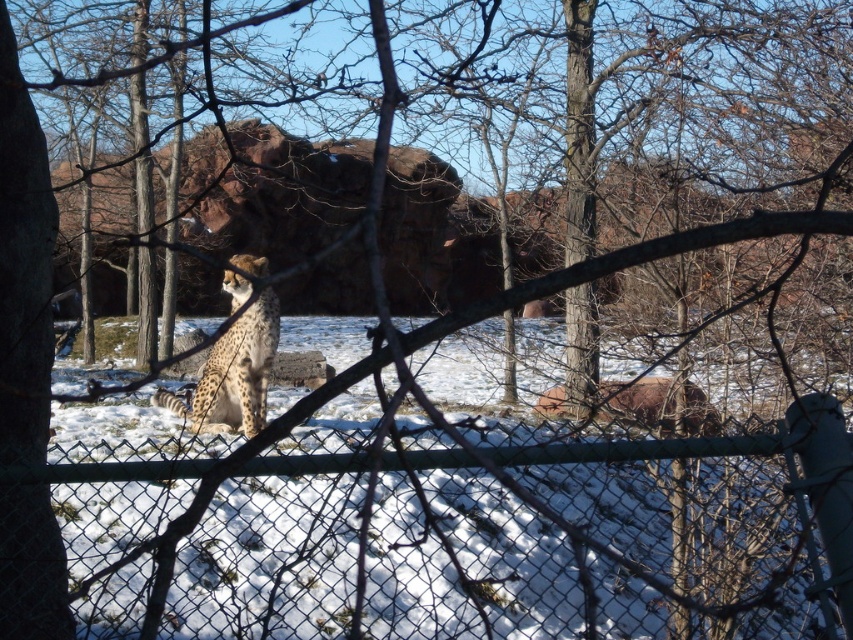
You are standing in front of the winter scene image. You see a point marked at coordinates (465,538). According to the image, what object is this point located on?

The point at coordinates (465,538) is located on the green chain link fence at center.

You are standing in front of the winter scene behind the chain link fence. You see two points marked on the image, point 1 at coordinates (521, 600) and point 2 at coordinates (263, 420). Which point is closer to you?

Point 1 at coordinates (521, 600) is closer to you than point 2 at coordinates (263, 420).